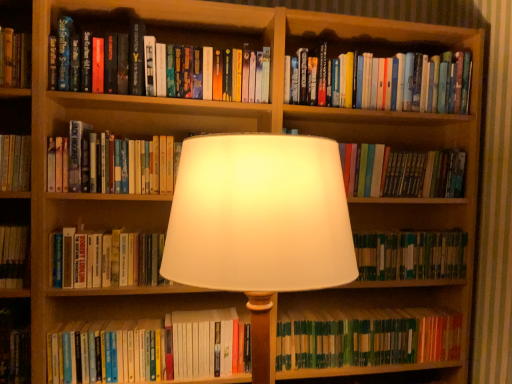
In order to face hardcover book at center, the fourth book in the bottom-to-top sequence, should I rotate leftwards or rightwards?

To align with it, rotate left about 17.028°.

What do you see at coordinates (401, 172) in the screenshot? The image size is (512, 384). I see `hardcover book at center, the fifth book from the bottom` at bounding box center [401, 172].

What are the coordinates of `hardcover book at center, the fifth book from the bottom` in the screenshot? It's located at (401, 172).

Locate an element on the screen. hardcover books at upper right, the seventh book from the bottom is located at coordinates (383, 82).

Identify the location of hardcover books at upper left, positioned as the first book in top-to-bottom order. (195, 71).

Identify the location of hardcover book at center, the fourth book in the bottom-to-top sequence. This screenshot has width=512, height=384. [105, 259].

Which is in front, point (447, 264) or point (397, 157)?

The point (397, 157) is closer to the camera.

From a real-world perspective, which is physically below, green matte book at center, the third book from the bottom, or hardcover book at center, the fifth book from the bottom?

In real-world perspective, green matte book at center, the third book from the bottom, is lower.

Is green matte book at center, which ranks as the 6th book in top-to-bottom order, wider or thinner than hardcover book at center, which is the 4th book from top to bottom?

In the image, green matte book at center, which ranks as the 6th book in top-to-bottom order, appears to be wider than hardcover book at center, which is the 4th book from top to bottom.

Would you consider green matte book at center, the third book from the bottom, to be distant from hardcover book at center, the fifth book from the bottom?

No, green matte book at center, the third book from the bottom, is not far away from hardcover book at center, the fifth book from the bottom.

From the picture: Is hardcover books at lower center, arranged as the seventh book when viewed from the top, completely or partially outside of hardcover book at center, the fourth book in the bottom-to-top sequence?

Indeed, hardcover books at lower center, arranged as the seventh book when viewed from the top, is completely outside hardcover book at center, the fourth book in the bottom-to-top sequence.

Considering the relative sizes of hardcover books at lower center, arranged as the seventh book when viewed from the top, and hardcover book at center, which is counted as the 5th book, starting from the top, in the image provided, is hardcover books at lower center, arranged as the seventh book when viewed from the top, smaller than hardcover book at center, which is counted as the 5th book, starting from the top,?

No.

From the picture: Which is more to the right, hardcover books at lower center, arranged as the seventh book when viewed from the top, or hardcover book at center, the fourth book in the bottom-to-top sequence?

From the viewer's perspective, hardcover books at lower center, arranged as the seventh book when viewed from the top, appears more on the right side.

Does hardcover books at lower center, the second book from the bottom, have a lesser height compared to hardcover book at center, which is counted as the 5th book, starting from the top?

Yes, hardcover books at lower center, the second book from the bottom, is shorter than hardcover book at center, which is counted as the 5th book, starting from the top.

Which is more to the left, hardcover books at lower center, arranged as the seventh book when viewed from the top, or white fabric lampshade at center?

Positioned to the left is hardcover books at lower center, arranged as the seventh book when viewed from the top.

Is hardcover books at lower center, arranged as the seventh book when viewed from the top, far away from white fabric lampshade at center?

hardcover books at lower center, arranged as the seventh book when viewed from the top, is actually quite close to white fabric lampshade at center.

Between hardcover books at lower center, arranged as the seventh book when viewed from the top, and white fabric lampshade at center, which one has larger size?

Bigger between the two is white fabric lampshade at center.

From the image's perspective, which is above, hardcover books at lower center, the second book from the bottom, or white fabric lampshade at center?

white fabric lampshade at center.

From the image's perspective, is hardcover book at center, which appears as the third book when viewed from the top, above hardcover books at upper left, the 8th book from the bottom?

No, from the image's perspective, hardcover book at center, which appears as the third book when viewed from the top, is not over hardcover books at upper left, the 8th book from the bottom.

Can you tell me how much hardcover book at center, acting as the sixth book starting from the bottom, and hardcover books at upper left, positioned as the first book in top-to-bottom order, differ in facing direction?

The facing directions of hardcover book at center, acting as the sixth book starting from the bottom, and hardcover books at upper left, positioned as the first book in top-to-bottom order, are 0.000629 degrees apart.

Considering the relative sizes of hardcover book at center, acting as the sixth book starting from the bottom, and hardcover books at upper left, the 8th book from the bottom, in the image provided, is hardcover book at center, acting as the sixth book starting from the bottom, wider than hardcover books at upper left, the 8th book from the bottom,?

No, hardcover book at center, acting as the sixth book starting from the bottom, is not wider than hardcover books at upper left, the 8th book from the bottom.

Considering the relative sizes of white fabric lampshade at center and hardcover book at center, which appears as the third book when viewed from the top, in the image provided, is white fabric lampshade at center shorter than hardcover book at center, which appears as the third book when viewed from the top,?

In fact, white fabric lampshade at center may be taller than hardcover book at center, which appears as the third book when viewed from the top.

From the image's perspective, which book is the 3rd one above the white fabric lampshade at center? Please provide its 2D coordinates.

[(111, 163)]

Is white fabric lampshade at center positioned with its back to hardcover book at center, which appears as the third book when viewed from the top?

Yes.

From the image's perspective, relative to hardcover book at center, which appears as the third book when viewed from the top, is white fabric lampshade at center above or below?

white fabric lampshade at center is below hardcover book at center, which appears as the third book when viewed from the top.

Locate an element on the screen. the 4th book located above the hardcover books at lower center, arranged as the seventh book when viewed from the top (from a real-world perspective) is located at coordinates (111, 163).

How many degrees apart are the facing directions of hardcover book at center, which appears as the third book when viewed from the top, and hardcover books at lower center, arranged as the seventh book when viewed from the top?

The angle between the facing direction of hardcover book at center, which appears as the third book when viewed from the top, and the facing direction of hardcover books at lower center, arranged as the seventh book when viewed from the top, is 0.000699 degrees.

Who is smaller, hardcover book at center, which appears as the third book when viewed from the top, or hardcover books at lower center, arranged as the seventh book when viewed from the top?

hardcover book at center, which appears as the third book when viewed from the top, is smaller.

From a real-world perspective, which is physically above, green matte book at center, which ranks as the 6th book in top-to-bottom order, or hardcover book at center, the fourth book in the bottom-to-top sequence?

In real-world perspective, hardcover book at center, the fourth book in the bottom-to-top sequence, is above.

Who is taller, green matte book at center, which ranks as the 6th book in top-to-bottom order, or hardcover book at center, the fourth book in the bottom-to-top sequence?

With more height is hardcover book at center, the fourth book in the bottom-to-top sequence.

In the scene shown: Is green matte book at center, which ranks as the 6th book in top-to-bottom order, looking in the opposite direction of hardcover book at center, which is counted as the 5th book, starting from the top?

No, green matte book at center, which ranks as the 6th book in top-to-bottom order, is not facing the opposite direction of hardcover book at center, which is counted as the 5th book, starting from the top.

Locate an element on the screen. The width and height of the screenshot is (512, 384). book that is the 2nd object to the left of the green matte book at center, the third book from the bottom, starting at the anchor is located at coordinates tap(401, 172).

From the hardcover book at center, which is counted as the 5th book, starting from the top, count 2nd books backward and point to it. Please provide its 2D coordinates.

[(146, 349)]

Estimate the real-world distances between objects in this image. Which object is further from green matte book at center, the third book from the bottom, hardcover book at center, the fifth book from the bottom, or hardcover book at center, the fourth book in the bottom-to-top sequence?

The object further to green matte book at center, the third book from the bottom, is hardcover book at center, the fourth book in the bottom-to-top sequence.

Looking at the image, which one is located further to green matte book at lower right, the 8th book positioned from the top, hardcover books at lower center, the second book from the bottom, or white fabric lampshade at center?

Based on the image, white fabric lampshade at center appears to be further to green matte book at lower right, the 8th book positioned from the top.

Estimate the real-world distances between objects in this image. Which object is closer to green matte book at center, the third book from the bottom, hardcover book at center, which appears as the third book when viewed from the top, or hardcover books at upper right, the seventh book from the bottom?

hardcover books at upper right, the seventh book from the bottom, is closer to green matte book at center, the third book from the bottom.

When comparing their distances from hardcover book at center, the fourth book in the bottom-to-top sequence, does white fabric lampshade at center or green matte book at center, the third book from the bottom, seem further?

green matte book at center, the third book from the bottom, lies further to hardcover book at center, the fourth book in the bottom-to-top sequence, than the other object.

Considering their positions, is hardcover books at upper right, acting as the 2th book starting from the top, positioned closer to white fabric lampshade at center than hardcover book at center, which appears as the third book when viewed from the top?

Among the two, hardcover book at center, which appears as the third book when viewed from the top, is located nearer to white fabric lampshade at center.

Estimate the real-world distances between objects in this image. Which object is further from hardcover book at center, which is counted as the 5th book, starting from the top, hardcover book at center, the fifth book from the bottom, or hardcover books at upper left, the 8th book from the bottom?

hardcover book at center, the fifth book from the bottom, lies further to hardcover book at center, which is counted as the 5th book, starting from the top, than the other object.

Estimate the real-world distances between objects in this image. Which object is closer to hardcover books at upper right, acting as the 2th book starting from the top, white fabric lampshade at center or hardcover book at center, which appears as the third book when viewed from the top?

Based on the image, hardcover book at center, which appears as the third book when viewed from the top, appears to be nearer to hardcover books at upper right, acting as the 2th book starting from the top.

Considering their positions, is hardcover book at center, the fifth book from the bottom, positioned closer to hardcover books at upper right, acting as the 2th book starting from the top, than hardcover books at lower center, the second book from the bottom?

hardcover book at center, the fifth book from the bottom, lies closer to hardcover books at upper right, acting as the 2th book starting from the top, than the other object.

Locate an element on the screen. The width and height of the screenshot is (512, 384). lamp between hardcover books at upper right, acting as the 2th book starting from the top, and hardcover books at lower center, the second book from the bottom, in the up-down direction is located at coordinates (259, 223).

At what (x,y) coordinates should I click in order to perform the action: click on lamp situated between hardcover books at lower center, arranged as the seventh book when viewed from the top, and green matte book at center, which ranks as the 6th book in top-to-bottom order, from left to right. Please return your answer as a coordinate pair (x, y). The width and height of the screenshot is (512, 384). Looking at the image, I should click on (259, 223).

Locate an element on the screen. lamp situated between hardcover book at center, the fourth book in the bottom-to-top sequence, and green matte book at center, which ranks as the 6th book in top-to-bottom order, from left to right is located at coordinates (259, 223).

This screenshot has width=512, height=384. In order to click on lamp between hardcover book at center, the fourth book in the bottom-to-top sequence, and green matte book at lower right, arranged as the first book when ordered from the bottom in this screenshot , I will do `click(259, 223)`.